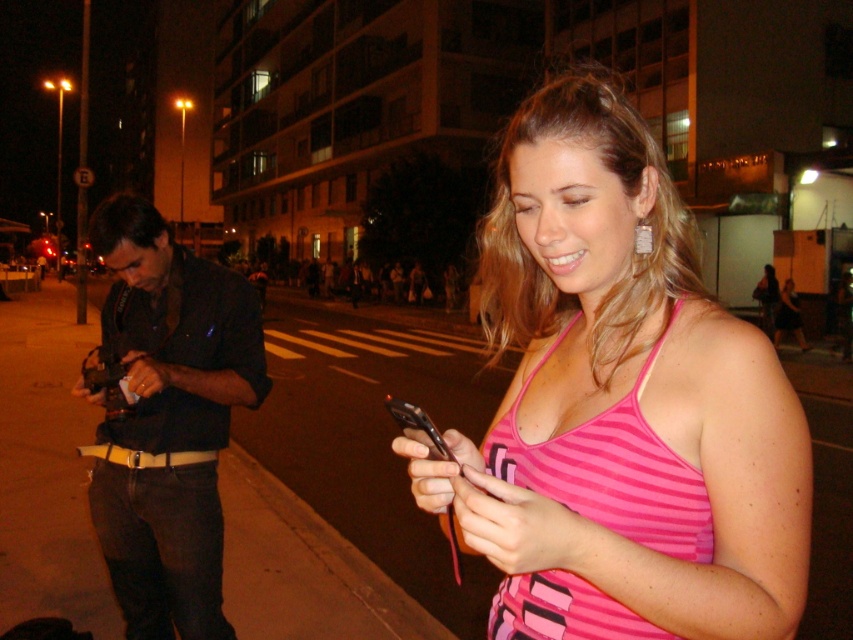
Is pink striped tank top at center below black leather shirt at left?

Incorrect, pink striped tank top at center is not positioned below black leather shirt at left.

I want to click on pink striped tank top at center, so click(x=619, y=404).

Between black leather shirt at left and black plastic sign at upper center, which one is positioned higher?

black plastic sign at upper center

From the picture: Who is more forward, (187,406) or (753,154)?

Positioned in front is point (187,406).

Where is `black leather shirt at left`? black leather shirt at left is located at coordinates (169, 420).

Does point (764, 460) come closer to viewer compared to point (715, 164)?

That is True.

Does pink striped tank top at center have a greater width compared to black plastic sign at upper center?

No, pink striped tank top at center is not wider than black plastic sign at upper center.

Does point (720, 362) lie in front of point (723, 160)?

Yes.

The image size is (853, 640). In order to click on pink striped tank top at center in this screenshot , I will do `click(619, 404)`.